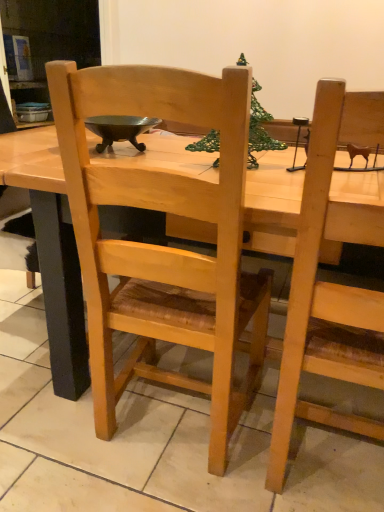
Where is `vacant space that's between natural wood chair at center and wooden table at center`? The width and height of the screenshot is (384, 512). vacant space that's between natural wood chair at center and wooden table at center is located at coordinates (125, 451).